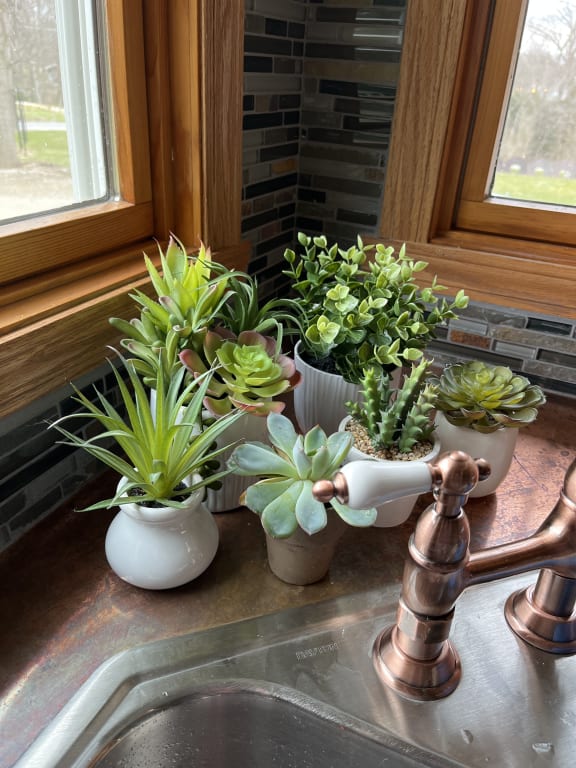
This screenshot has width=576, height=768. I want to click on engraving on sink, so click(313, 646).